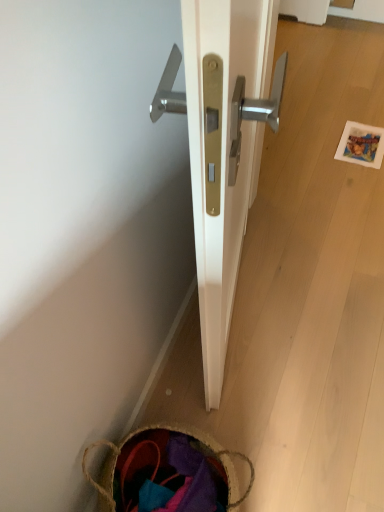
Question: Does brown woven basket at lower left lie in front of polished brass door handle at center?

Choices:
 (A) no
 (B) yes

Answer: (A)

Question: Can you confirm if brown woven basket at lower left is smaller than polished brass door handle at center?

Choices:
 (A) yes
 (B) no

Answer: (A)

Question: Is brown woven basket at lower left shorter than polished brass door handle at center?

Choices:
 (A) no
 (B) yes

Answer: (B)

Question: Considering the relative sizes of brown woven basket at lower left and polished brass door handle at center in the image provided, is brown woven basket at lower left wider than polished brass door handle at center?

Choices:
 (A) no
 (B) yes

Answer: (B)

Question: From a real-world perspective, is brown woven basket at lower left below polished brass door handle at center?

Choices:
 (A) no
 (B) yes

Answer: (B)

Question: Is polished brass door handle at center located within brown woven basket at lower left?

Choices:
 (A) yes
 (B) no

Answer: (B)

Question: Is polished brass door handle at center oriented towards brown woven basket at lower left?

Choices:
 (A) yes
 (B) no

Answer: (B)

Question: Is brown woven basket at lower left inside polished brass door handle at center?

Choices:
 (A) no
 (B) yes

Answer: (A)

Question: Is polished brass door handle at center bigger than brown woven basket at lower left?

Choices:
 (A) yes
 (B) no

Answer: (A)

Question: From a real-world perspective, is polished brass door handle at center located beneath brown woven basket at lower left?

Choices:
 (A) yes
 (B) no

Answer: (B)

Question: Can you confirm if polished brass door handle at center is thinner than brown woven basket at lower left?

Choices:
 (A) yes
 (B) no

Answer: (A)

Question: From the image's perspective, is polished brass door handle at center located beneath brown woven basket at lower left?

Choices:
 (A) no
 (B) yes

Answer: (A)

Question: Choose the correct answer: Is brown woven basket at lower left inside polished brass door handle at center or outside it?

Choices:
 (A) outside
 (B) inside

Answer: (A)